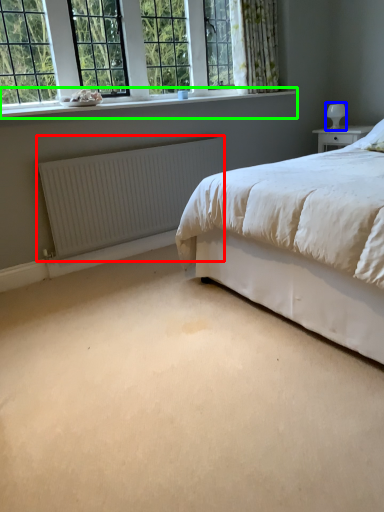
Question: Estimate the real-world distances between objects in this image. Which object is farther from radiator (highlighted by a red box), table lamp (highlighted by a blue box) or window sill (highlighted by a green box)?

Choices:
 (A) table lamp
 (B) window sill

Answer: (A)